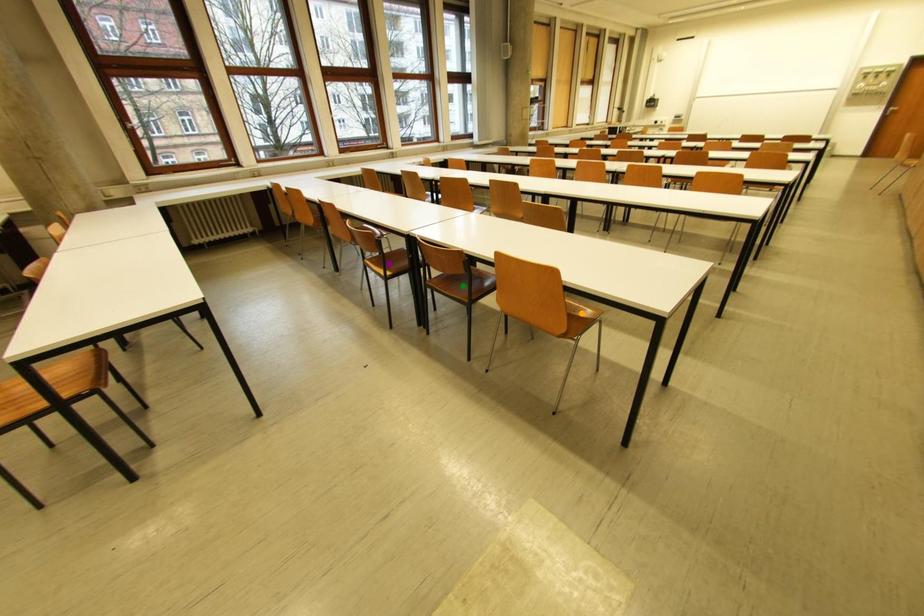
Looking at this image, order these from nearest to farthest:
A) purple point
B) green point
C) orange point

orange point < green point < purple point